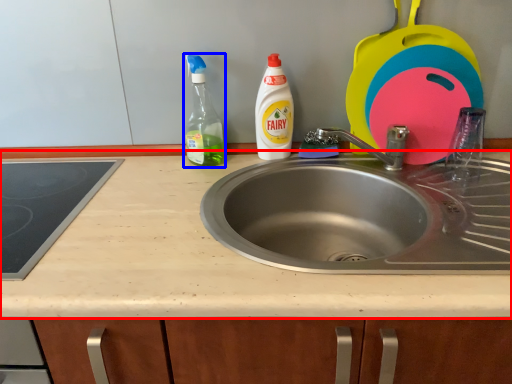
Question: Which object appears farthest to the camera in this image, countertop (highlighted by a red box) or cleaning product (highlighted by a blue box)?

Choices:
 (A) countertop
 (B) cleaning product

Answer: (B)